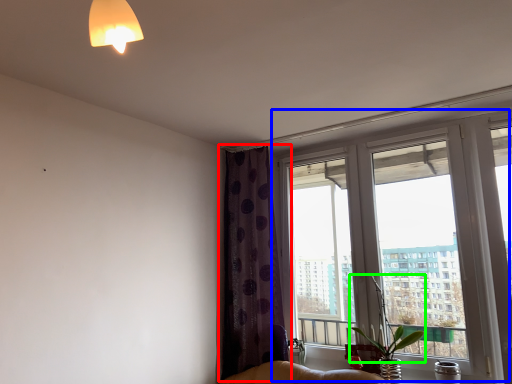
Question: Which is nearer to the curtain (highlighted by a red box)? window (highlighted by a blue box) or plant (highlighted by a green box).

Choices:
 (A) window
 (B) plant

Answer: (A)